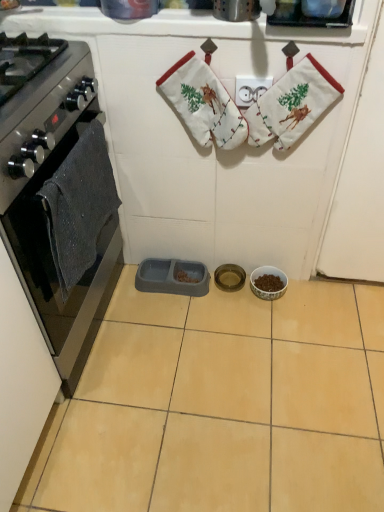
You are a GUI agent. You are given a task and a screenshot of the screen. Output one action in this format:
    pyautogui.click(x=<x>, y=<y>)
    Task: Click on the black glass oven at left
    
    Given the screenshot: What is the action you would take?
    pyautogui.click(x=58, y=196)

This screenshot has width=384, height=512. What do you see at coordinates (229, 277) in the screenshot?
I see `metallic gold bowl at center, arranged as the 2th appliance when viewed from the right` at bounding box center [229, 277].

Identify the location of dark gray knitted hand towel at left, marked as the second hand towel in a right-to-left arrangement. (79, 206).

How much space does white cotton hand towel at upper center, acting as the first hand towel starting from the right, occupy vertically?

A: The height of white cotton hand towel at upper center, acting as the first hand towel starting from the right, is 13.93 inches.

Locate an element on the screen. white fabric stocking at upper center is located at coordinates (292, 104).

At what (x,y) coordinates should I click in order to perform the action: click on black glass oven at left. Please return your answer as a coordinate pair (x, y). Looking at the image, I should click on (58, 196).

Is metallic gold bowl at center, which ranks as the second appliance in left-to-right order, positioned far away from black glass oven at left?

metallic gold bowl at center, which ranks as the second appliance in left-to-right order, is near black glass oven at left, not far away.

From a real-world perspective, is metallic gold bowl at center, which ranks as the second appliance in left-to-right order, physically located above or below black glass oven at left?

metallic gold bowl at center, which ranks as the second appliance in left-to-right order, is below black glass oven at left.

Who is shorter, metallic gold bowl at center, arranged as the 2th appliance when viewed from the right, or black glass oven at left?

Standing shorter between the two is metallic gold bowl at center, arranged as the 2th appliance when viewed from the right.

What are the coordinates of `kitchen appliance on the left of metallic gold bowl at center, arranged as the 2th appliance when viewed from the right` in the screenshot? It's located at (58, 196).

Can you confirm if white fabric stocking at upper center is smaller than porcelain bowl at center, the third appliance in the left-to-right sequence?

No, white fabric stocking at upper center is not smaller than porcelain bowl at center, the third appliance in the left-to-right sequence.

Considering the relative positions of white fabric stocking at upper center and porcelain bowl at center, which is the first appliance from right to left, in the image provided, is white fabric stocking at upper center to the left of porcelain bowl at center, which is the first appliance from right to left, from the viewer's perspective?

Indeed, white fabric stocking at upper center is positioned on the left side of porcelain bowl at center, which is the first appliance from right to left.

Which of these two, white fabric stocking at upper center or porcelain bowl at center, which is the first appliance from right to left, is wider?

Wider between the two is porcelain bowl at center, which is the first appliance from right to left.

From the image's perspective, is white fabric stocking at upper center positioned above or below porcelain bowl at center, the third appliance in the left-to-right sequence?

white fabric stocking at upper center is above porcelain bowl at center, the third appliance in the left-to-right sequence.

From the image's perspective, is white fabric stocking at upper center on metallic gold bowl at center, arranged as the 2th appliance when viewed from the right?

Indeed, from the image's perspective, white fabric stocking at upper center is shown above metallic gold bowl at center, arranged as the 2th appliance when viewed from the right.

Is white fabric stocking at upper center thinner than metallic gold bowl at center, arranged as the 2th appliance when viewed from the right?

Indeed, white fabric stocking at upper center has a lesser width compared to metallic gold bowl at center, arranged as the 2th appliance when viewed from the right.

How different are the orientations of white fabric stocking at upper center and metallic gold bowl at center, arranged as the 2th appliance when viewed from the right, in degrees?

The angular difference between white fabric stocking at upper center and metallic gold bowl at center, arranged as the 2th appliance when viewed from the right, is 177 degrees.

In the scene shown: Looking at their sizes, would you say gray plastic pet feeder at center, arranged as the 1th appliance when viewed from the left, is wider or thinner than beige ceramic tile at center?

In the image, gray plastic pet feeder at center, arranged as the 1th appliance when viewed from the left, appears to be more narrow than beige ceramic tile at center.

Considering the sizes of objects gray plastic pet feeder at center, which is the third appliance in right-to-left order, and beige ceramic tile at center in the image provided, who is shorter, gray plastic pet feeder at center, which is the third appliance in right-to-left order, or beige ceramic tile at center?

With less height is beige ceramic tile at center.

From a real-world perspective, is gray plastic pet feeder at center, which is the third appliance in right-to-left order, physically located above or below beige ceramic tile at center?

gray plastic pet feeder at center, which is the third appliance in right-to-left order, is above beige ceramic tile at center.

This screenshot has height=512, width=384. Identify the location of ceramic tile that is in front of the porcelain bowl at center, the third appliance in the left-to-right sequence. (222, 405).

Consider the image. Between beige ceramic tile at center and porcelain bowl at center, the third appliance in the left-to-right sequence, which one has larger size?

beige ceramic tile at center.

From the image's perspective, is beige ceramic tile at center located above porcelain bowl at center, which is the first appliance from right to left?

No, from the image's perspective, beige ceramic tile at center is not on top of porcelain bowl at center, which is the first appliance from right to left.

Considering the relative positions of beige ceramic tile at center and porcelain bowl at center, the third appliance in the left-to-right sequence, in the image provided, is beige ceramic tile at center to the left or to the right of porcelain bowl at center, the third appliance in the left-to-right sequence,?

Based on their positions, beige ceramic tile at center is located to the left of porcelain bowl at center, the third appliance in the left-to-right sequence.

Identify the location of appliance that is the 2nd one below the white cotton hand towel at upper center, which appears as the second hand towel when viewed from the left (from a real-world perspective). (229, 277).

Considering the sizes of metallic gold bowl at center, arranged as the 2th appliance when viewed from the right, and white cotton hand towel at upper center, acting as the first hand towel starting from the right, in the image, is metallic gold bowl at center, arranged as the 2th appliance when viewed from the right, wider or thinner than white cotton hand towel at upper center, acting as the first hand towel starting from the right,?

Considering their sizes, metallic gold bowl at center, arranged as the 2th appliance when viewed from the right, looks broader than white cotton hand towel at upper center, acting as the first hand towel starting from the right.

From the image's perspective, relative to white cotton hand towel at upper center, acting as the first hand towel starting from the right, is metallic gold bowl at center, which ranks as the second appliance in left-to-right order, above or below?

From the image's perspective, metallic gold bowl at center, which ranks as the second appliance in left-to-right order, appears below white cotton hand towel at upper center, acting as the first hand towel starting from the right.

From a real-world perspective, is metallic gold bowl at center, which ranks as the second appliance in left-to-right order, physically above white cotton hand towel at upper center, which appears as the second hand towel when viewed from the left?

No, from a real-world perspective, metallic gold bowl at center, which ranks as the second appliance in left-to-right order, is not above white cotton hand towel at upper center, which appears as the second hand towel when viewed from the left.

How many degrees apart are the facing directions of black glass oven at left and white cotton hand towel at upper center, which appears as the second hand towel when viewed from the left?

97.2 degrees separate the facing orientations of black glass oven at left and white cotton hand towel at upper center, which appears as the second hand towel when viewed from the left.

From the image's perspective, is black glass oven at left located beneath white cotton hand towel at upper center, acting as the first hand towel starting from the right?

Indeed, from the image's perspective, black glass oven at left is shown beneath white cotton hand towel at upper center, acting as the first hand towel starting from the right.

Is the surface of black glass oven at left in direct contact with white cotton hand towel at upper center, which appears as the second hand towel when viewed from the left?

black glass oven at left is not next to white cotton hand towel at upper center, which appears as the second hand towel when viewed from the left, and they're not touching.

This screenshot has width=384, height=512. Find the location of `kitchen appliance on the left of the metallic gold bowl at center, which ranks as the second appliance in left-to-right order`. kitchen appliance on the left of the metallic gold bowl at center, which ranks as the second appliance in left-to-right order is located at coordinates (58, 196).

Where is `the 1st appliance behind the white fabric stocking at upper center`? the 1st appliance behind the white fabric stocking at upper center is located at coordinates (272, 277).

Which object lies nearer to the anchor point gray plastic pet feeder at center, arranged as the 1th appliance when viewed from the left, white cotton hand towel at upper center, which appears as the second hand towel when viewed from the left, or black glass oven at left?

black glass oven at left is closer to gray plastic pet feeder at center, arranged as the 1th appliance when viewed from the left.

From the image, which object appears to be farther from white fabric stocking at upper center, gray plastic pet feeder at center, which is the third appliance in right-to-left order, or porcelain bowl at center, the third appliance in the left-to-right sequence?

The object further to white fabric stocking at upper center is gray plastic pet feeder at center, which is the third appliance in right-to-left order.

Considering their positions, is dark gray knitted hand towel at left, marked as the second hand towel in a right-to-left arrangement, positioned further to beige ceramic tile at center than gray plastic pet feeder at center, which is the third appliance in right-to-left order?

The object further to beige ceramic tile at center is dark gray knitted hand towel at left, marked as the second hand towel in a right-to-left arrangement.

From the image, which object appears to be nearer to gray plastic pet feeder at center, which is the third appliance in right-to-left order, porcelain bowl at center, which is the first appliance from right to left, or dark gray knitted hand towel at left, acting as the 1th hand towel starting from the left?

Based on the image, porcelain bowl at center, which is the first appliance from right to left, appears to be nearer to gray plastic pet feeder at center, which is the third appliance in right-to-left order.

From the image, which object appears to be nearer to white cotton hand towel at upper center, acting as the first hand towel starting from the right, porcelain bowl at center, which is the first appliance from right to left, or black glass oven at left?

black glass oven at left lies closer to white cotton hand towel at upper center, acting as the first hand towel starting from the right, than the other object.

Looking at the image, which one is located further to gray plastic pet feeder at center, which is the third appliance in right-to-left order, white fabric stocking at upper center or porcelain bowl at center, which is the first appliance from right to left?

white fabric stocking at upper center is further to gray plastic pet feeder at center, which is the third appliance in right-to-left order.

Looking at the image, which one is located closer to beige ceramic tile at center, dark gray knitted hand towel at left, acting as the 1th hand towel starting from the left, or white fabric stocking at upper center?

The object closer to beige ceramic tile at center is dark gray knitted hand towel at left, acting as the 1th hand towel starting from the left.

When comparing their distances from black glass oven at left, does gray plastic pet feeder at center, arranged as the 1th appliance when viewed from the left, or white fabric stocking at upper center seem closer?

Based on the image, gray plastic pet feeder at center, arranged as the 1th appliance when viewed from the left, appears to be nearer to black glass oven at left.

The image size is (384, 512). I want to click on material between dark gray knitted hand towel at left, marked as the second hand towel in a right-to-left arrangement, and metallic gold bowl at center, which ranks as the second appliance in left-to-right order, along the z-axis, so click(x=292, y=104).

Find the location of `material between black glass oven at left and porcelain bowl at center, the third appliance in the left-to-right sequence`. material between black glass oven at left and porcelain bowl at center, the third appliance in the left-to-right sequence is located at coordinates (292, 104).

At what (x,y) coordinates should I click in order to perform the action: click on material between dark gray knitted hand towel at left, acting as the 1th hand towel starting from the left, and porcelain bowl at center, the third appliance in the left-to-right sequence, along the z-axis. Please return your answer as a coordinate pair (x, y). Image resolution: width=384 pixels, height=512 pixels. Looking at the image, I should click on (292, 104).

Where is `hand towel between white fabric stocking at upper center and gray plastic pet feeder at center, arranged as the 1th appliance when viewed from the left, from front to back`? hand towel between white fabric stocking at upper center and gray plastic pet feeder at center, arranged as the 1th appliance when viewed from the left, from front to back is located at coordinates (203, 103).